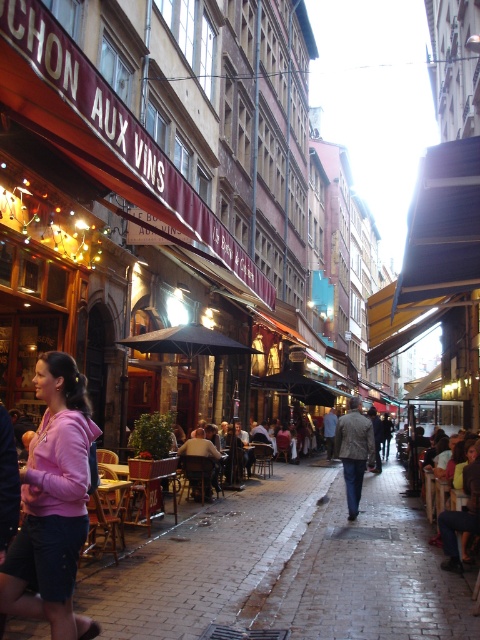
Question: Which object appears farthest from the camera in this image?

Choices:
 (A) pink fleece jacket at center
 (B) brick pavement at center

Answer: (B)

Question: Does brick pavement at center appear on the right side of pink fleece jacket at center?

Choices:
 (A) no
 (B) yes

Answer: (B)

Question: Among these points, which one is farthest from the camera?

Choices:
 (A) (20, 541)
 (B) (299, 481)

Answer: (B)

Question: Does brick pavement at center appear on the right side of pink fleece jacket at center?

Choices:
 (A) no
 (B) yes

Answer: (B)

Question: Is brick pavement at center behind pink fleece jacket at center?

Choices:
 (A) no
 (B) yes

Answer: (B)

Question: Which object is closer to the camera taking this photo?

Choices:
 (A) brick pavement at center
 (B) pink fleece jacket at center

Answer: (B)